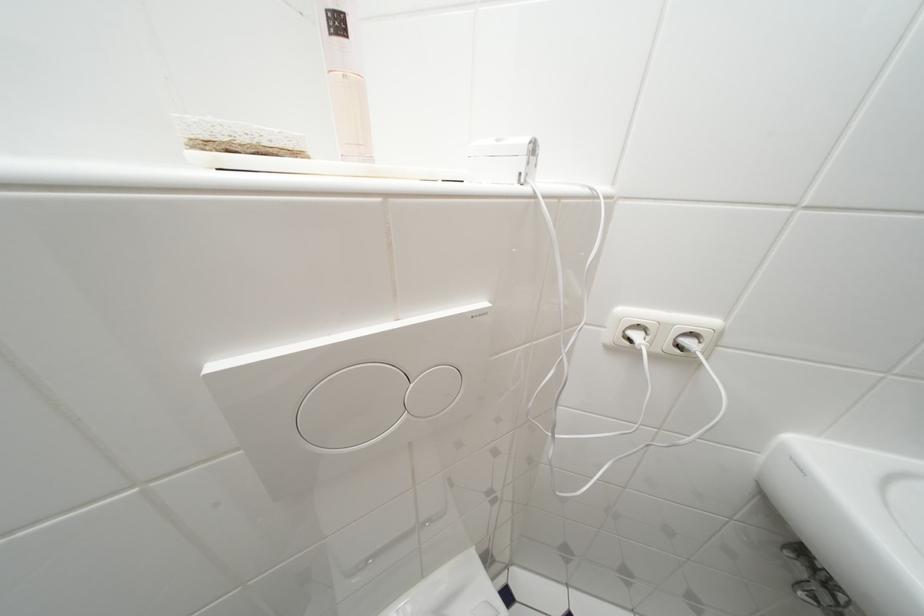
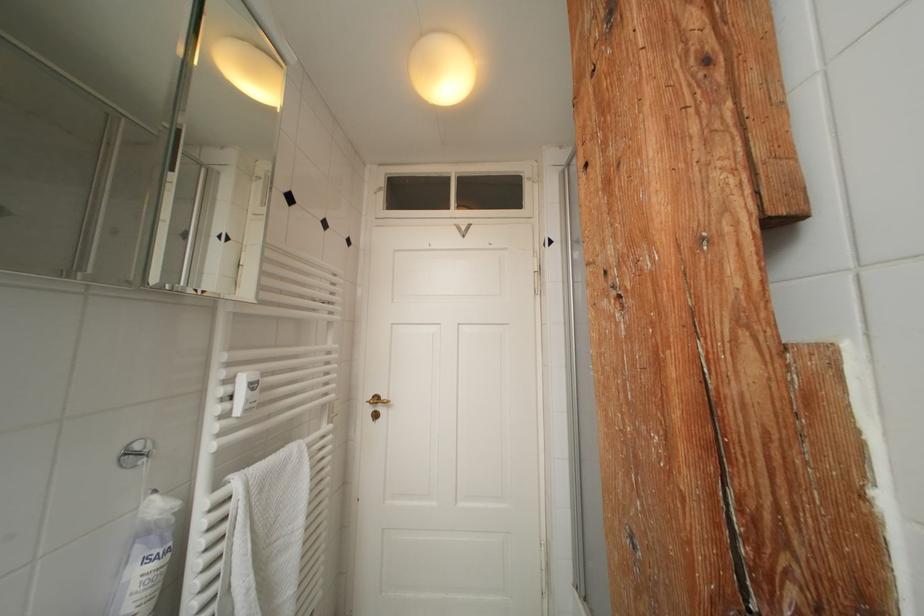
Question: The first image is from the beginning of the video and the second image is from the end. How did the camera likely rotate when shooting the video?

Choices:
 (A) Left
 (B) Right
 (C) Up
 (D) Down

Answer: (B)